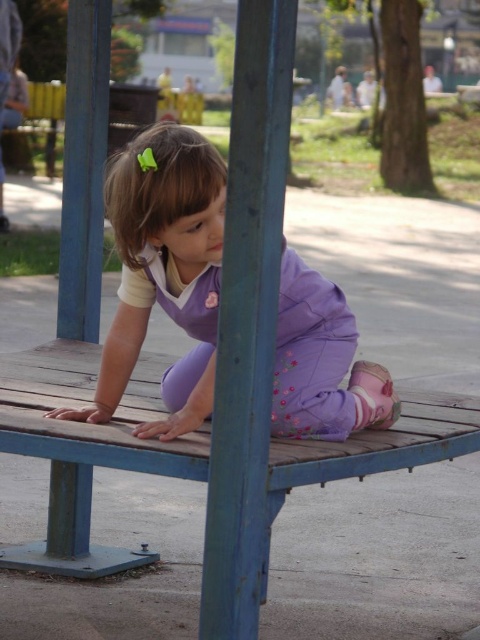
Question: Among these objects, which one is nearest to the camera?

Choices:
 (A) wooden bench at center
 (B) purple fabric at center

Answer: (A)

Question: Is wooden bench at center bigger than purple fabric at center?

Choices:
 (A) yes
 (B) no

Answer: (A)

Question: Is wooden bench at center closer to camera compared to purple fabric at center?

Choices:
 (A) yes
 (B) no

Answer: (A)

Question: Which point is closer to the camera?

Choices:
 (A) purple fabric at center
 (B) wooden bench at center

Answer: (B)

Question: Among these points, which one is nearest to the camera?

Choices:
 (A) (372, 449)
 (B) (216, 176)

Answer: (B)

Question: Can you confirm if wooden bench at center is wider than purple fabric at center?

Choices:
 (A) yes
 (B) no

Answer: (A)